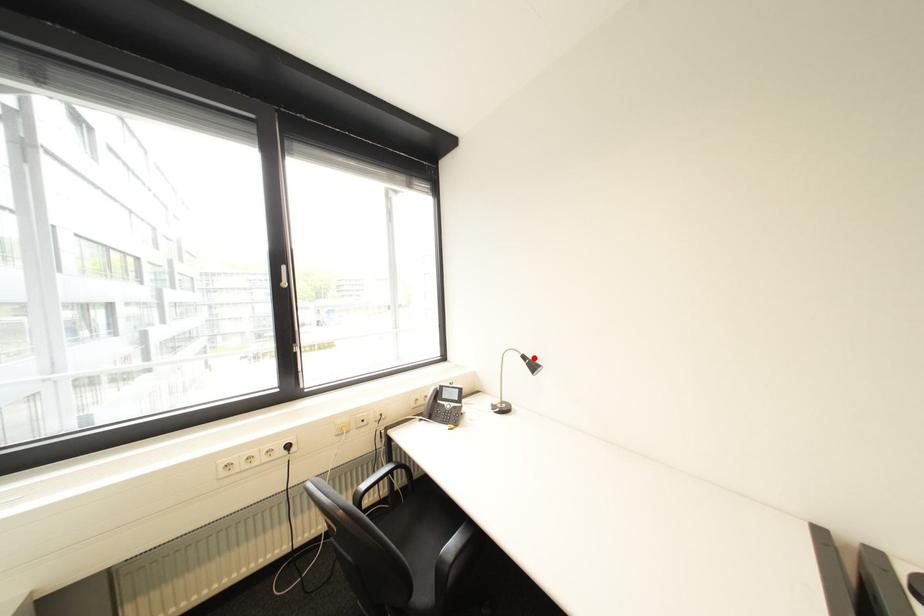
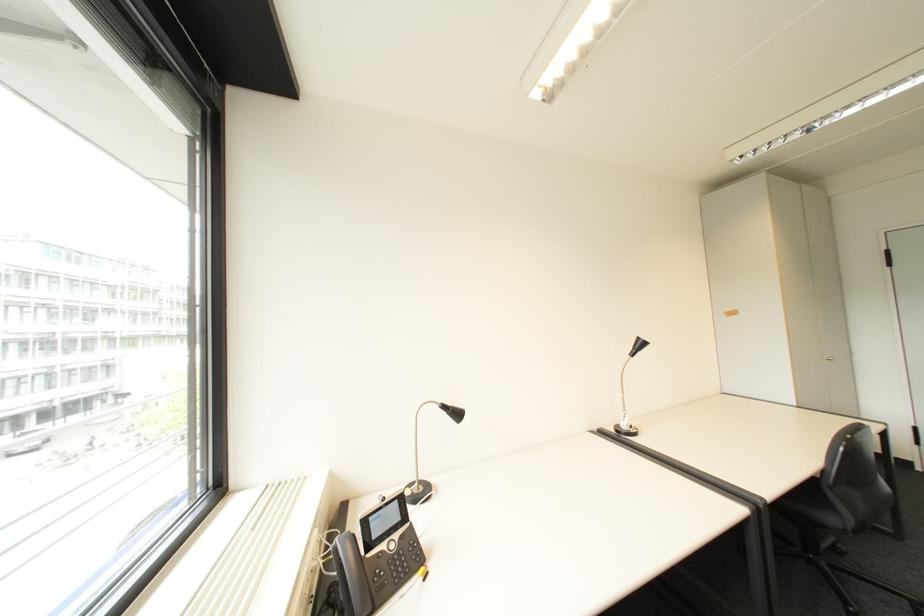
In the second image, find the point that corresponds to the highlighted location in the first image.

(455, 407)